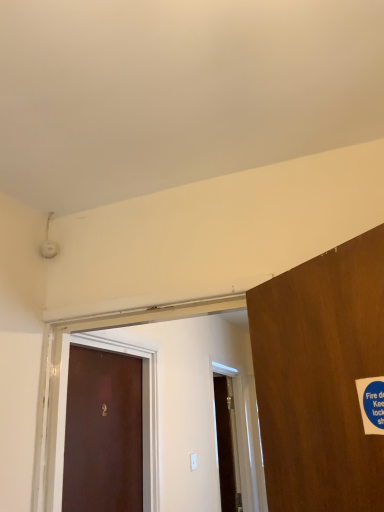
Locate an element on the screen. The width and height of the screenshot is (384, 512). brown matte door at left is located at coordinates (103, 432).

Describe the element at coordinates (103, 432) in the screenshot. This screenshot has width=384, height=512. I see `brown matte door at left` at that location.

Locate an element on the screen. brown matte door at left is located at coordinates (103, 432).